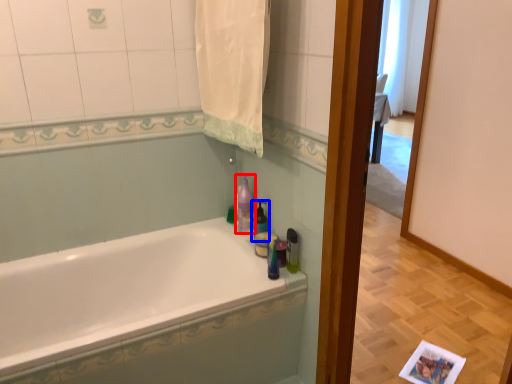
Question: Which object is further to the camera taking this photo, cleaning product (highlighted by a red box) or soap dispenser (highlighted by a blue box)?

Choices:
 (A) cleaning product
 (B) soap dispenser

Answer: (A)